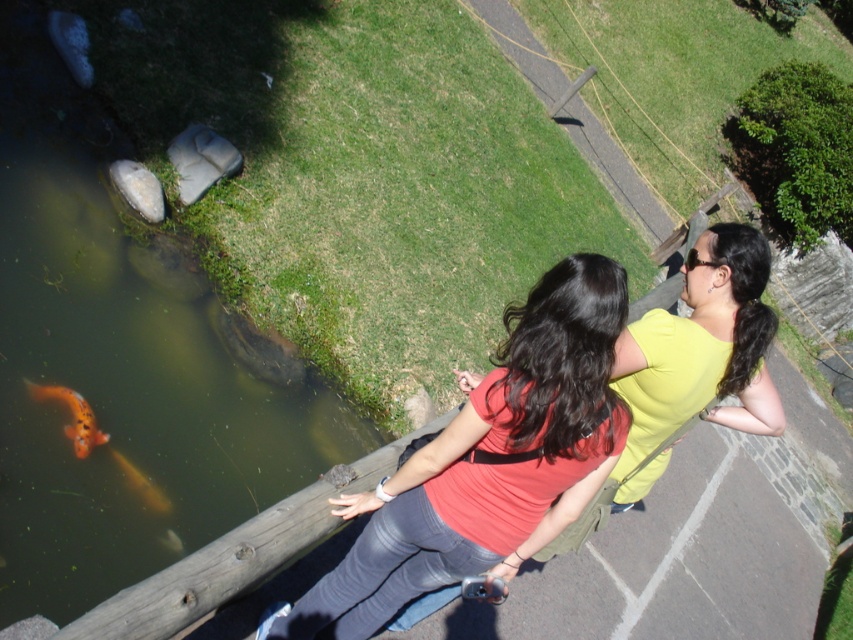
How distant is greenish murky water at lower left from matte red shirt at center?

greenish murky water at lower left is 2.40 meters from matte red shirt at center.

Looking at this image, who is positioned more to the right, greenish murky water at lower left or matte red shirt at center?

matte red shirt at center

Which is in front, point (207, 506) or point (375, 525)?

Point (375, 525) is in front.

Locate an element on the screen. greenish murky water at lower left is located at coordinates (117, 365).

Can you confirm if matte red shirt at center is positioned below orange shiny fish at lower left?

No, matte red shirt at center is not below orange shiny fish at lower left.

What do you see at coordinates (486, 464) in the screenshot?
I see `matte red shirt at center` at bounding box center [486, 464].

Which is behind, point (483, 560) or point (136, 474)?

The point (136, 474) is more distant.

Find the location of a particular element. matte red shirt at center is located at coordinates (486, 464).

Is matte red shirt at center below orange glossy fish at lower left?

Correct, matte red shirt at center is located below orange glossy fish at lower left.

Who is shorter, matte red shirt at center or orange glossy fish at lower left?

orange glossy fish at lower left is shorter.

Image resolution: width=853 pixels, height=640 pixels. What are the coordinates of `matte red shirt at center` in the screenshot? It's located at (486, 464).

At what (x,y) coordinates should I click in order to perform the action: click on matte red shirt at center. Please return your answer as a coordinate pair (x, y). The height and width of the screenshot is (640, 853). Looking at the image, I should click on (486, 464).